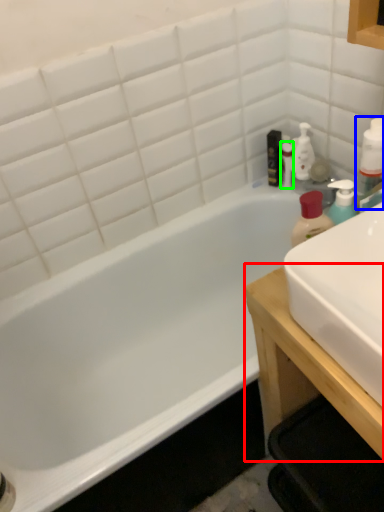
Question: Based on their relative distances, which object is farther from table (highlighted by a red box)? Choose from bottle (highlighted by a blue box) and toiletry (highlighted by a green box).

Choices:
 (A) bottle
 (B) toiletry

Answer: (B)